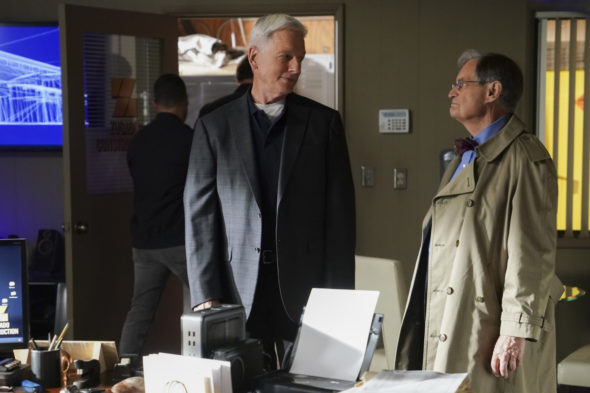
Locate an element on the screen. coat is located at coordinates (236, 221), (503, 202).